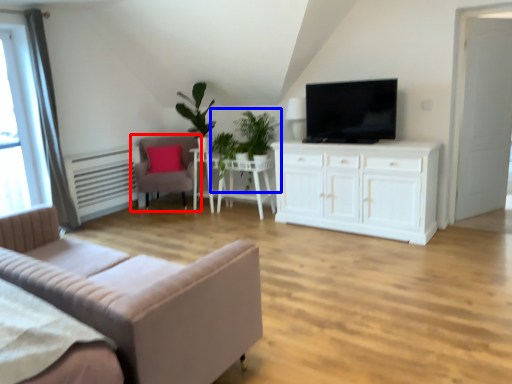
Question: Which object appears closest to the camera in this image, chair (highlighted by a red box) or plant (highlighted by a blue box)?

Choices:
 (A) chair
 (B) plant

Answer: (B)